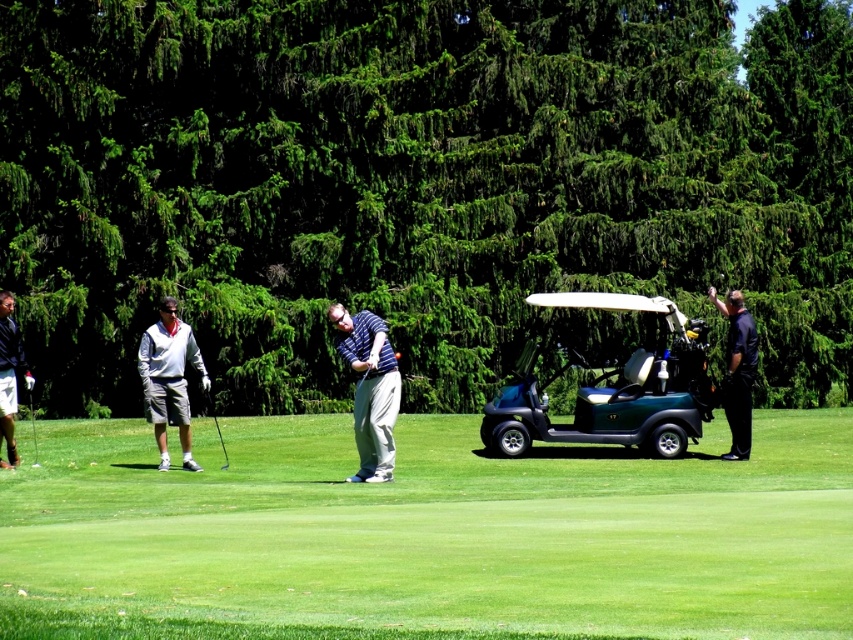
Consider the image. You are a golfer who needs to retrieve a golf club. You see the black smooth golf club at right and the metallic silver golf club at center. Which one is located above the other?

The black smooth golf club at right is positioned over the metallic silver golf club at center, so it is located above the other.